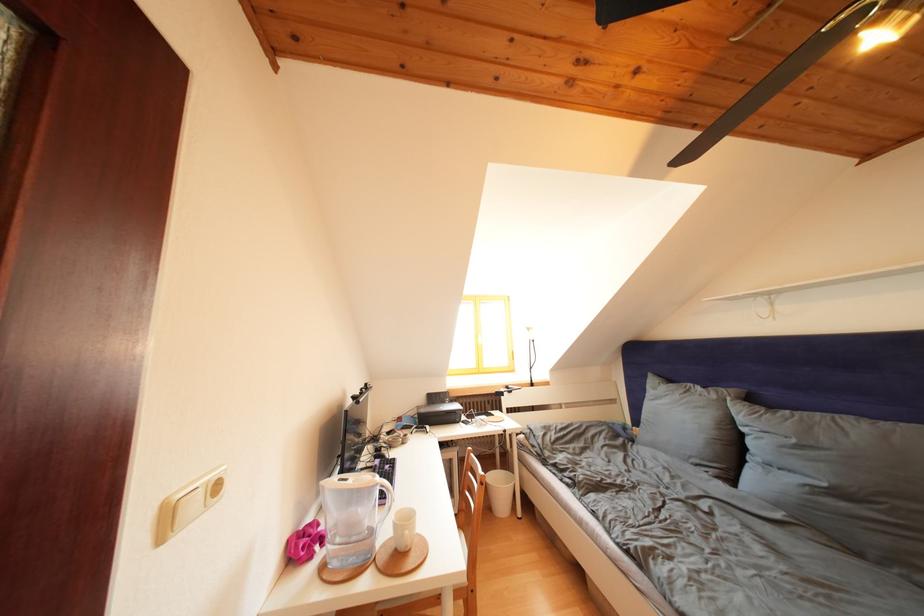
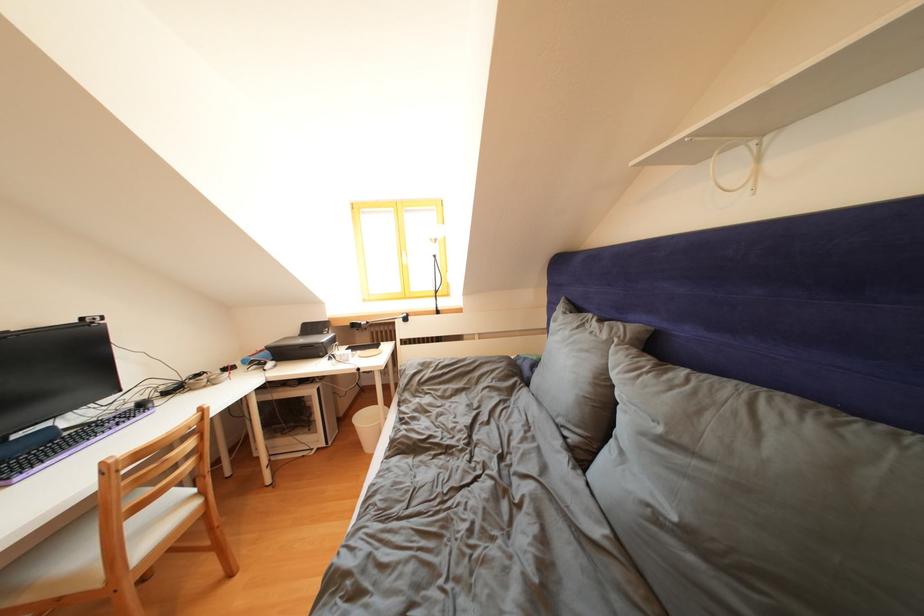
What movement of the cameraman would produce the second image?

The movement direction of the cameraman is right, forward.